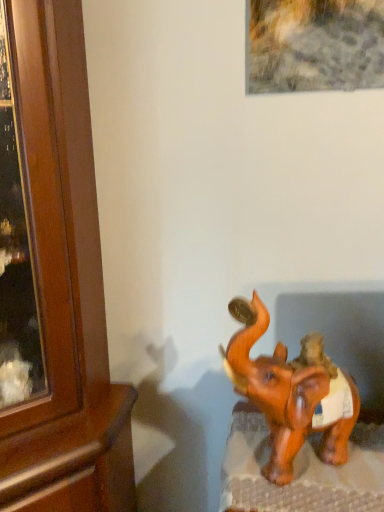
Describe the element at coordinates (54, 279) in the screenshot. Image resolution: width=384 pixels, height=512 pixels. I see `wooden cabinet at left` at that location.

What is the approximate width of wooden cabinet at left?

wooden cabinet at left is 21.45 inches in width.

Find the location of `wooden cabinet at left`. wooden cabinet at left is located at coordinates (54, 279).

Measure the distance between point [64,106] and camera.

They are 35.16 inches apart.

You are a GUI agent. You are given a task and a screenshot of the screen. Output one action in this format:
    pyautogui.click(x=<x>, y=<y>)
    Task: Click on the brown glossy elephant at lower right
    
    Given the screenshot: What is the action you would take?
    pyautogui.click(x=291, y=392)

The image size is (384, 512). Describe the element at coordinates (291, 392) in the screenshot. I see `brown glossy elephant at lower right` at that location.

At what (x,y) coordinates should I click in order to perform the action: click on wooden cabinet at left. Please return your answer as a coordinate pair (x, y). This screenshot has width=384, height=512. Looking at the image, I should click on (54, 279).

Considering the positions of objects brown glossy elephant at lower right and wooden cabinet at left in the image provided, who is more to the right, brown glossy elephant at lower right or wooden cabinet at left?

Positioned to the right is brown glossy elephant at lower right.

Who is more distant, brown glossy elephant at lower right or wooden cabinet at left?

brown glossy elephant at lower right is further away from the camera.

Which is behind, point (333, 400) or point (33, 44)?

The point (333, 400) is behind.

From the image's perspective, relative to wooden cabinet at left, is brown glossy elephant at lower right above or below?

From the image's perspective, brown glossy elephant at lower right appears below wooden cabinet at left.

Looking at this image, from a real-world perspective, which is physically below, brown glossy elephant at lower right or wooden cabinet at left?

From a 3D spatial view, wooden cabinet at left is below.

Which object is wider, brown glossy elephant at lower right or wooden cabinet at left?

wooden cabinet at left is wider.

Can you confirm if brown glossy elephant at lower right is taller than wooden cabinet at left?

A: No.

Does brown glossy elephant at lower right have a smaller size compared to wooden cabinet at left?

Yes, brown glossy elephant at lower right is smaller than wooden cabinet at left.

Based on the photo, can wooden cabinet at left be found inside brown glossy elephant at lower right?

That's incorrect, wooden cabinet at left is not inside brown glossy elephant at lower right.

Does brown glossy elephant at lower right touch wooden cabinet at left?

No, brown glossy elephant at lower right is not touching wooden cabinet at left.

Could you tell me if brown glossy elephant at lower right is turned towards wooden cabinet at left?

No, brown glossy elephant at lower right is not aimed at wooden cabinet at left.

From the picture: How much distance is there between brown glossy elephant at lower right and wooden cabinet at left?

They are 18.94 inches apart.

The width and height of the screenshot is (384, 512). I want to click on elephant below the wooden cabinet at left (from the image's perspective), so click(291, 392).

Is wooden cabinet at left to the left of brown glossy elephant at lower right from the viewer's perspective?

Yes, wooden cabinet at left is to the left of brown glossy elephant at lower right.

Which object is more forward, wooden cabinet at left or brown glossy elephant at lower right?

Positioned in front is wooden cabinet at left.

Which point is more distant from viewer, (79, 158) or (329, 410)?

The point (79, 158) is more distant.

In the scene shown: From the image's perspective, is wooden cabinet at left beneath brown glossy elephant at lower right?

No.

From a real-world perspective, is wooden cabinet at left physically below brown glossy elephant at lower right?

Yes, from a real-world perspective, wooden cabinet at left is beneath brown glossy elephant at lower right.

In terms of width, does wooden cabinet at left look wider or thinner when compared to brown glossy elephant at lower right?

Clearly, wooden cabinet at left has more width compared to brown glossy elephant at lower right.

Which of these two, wooden cabinet at left or brown glossy elephant at lower right, stands shorter?

brown glossy elephant at lower right is shorter.

Which of these two, wooden cabinet at left or brown glossy elephant at lower right, is bigger?

Bigger between the two is wooden cabinet at left.

Looking at this image, is wooden cabinet at left positioned beyond the bounds of brown glossy elephant at lower right?

→ Absolutely, wooden cabinet at left is external to brown glossy elephant at lower right.

Would you consider wooden cabinet at left to be distant from brown glossy elephant at lower right?

No.

Is wooden cabinet at left positioned with its back to brown glossy elephant at lower right?

wooden cabinet at left is not turned away from brown glossy elephant at lower right.

Can you tell me how much wooden cabinet at left and brown glossy elephant at lower right differ in facing direction?

19 degrees.

Measure the distance from wooden cabinet at left to brown glossy elephant at lower right.

18.94 inches.

Identify the location of cabinetry above the brown glossy elephant at lower right (from the image's perspective). This screenshot has width=384, height=512. (54, 279).

Locate an element on the screen. cabinetry in front of the brown glossy elephant at lower right is located at coordinates (54, 279).

Where is `elephant behind the wooden cabinet at left`? This screenshot has width=384, height=512. elephant behind the wooden cabinet at left is located at coordinates (291, 392).